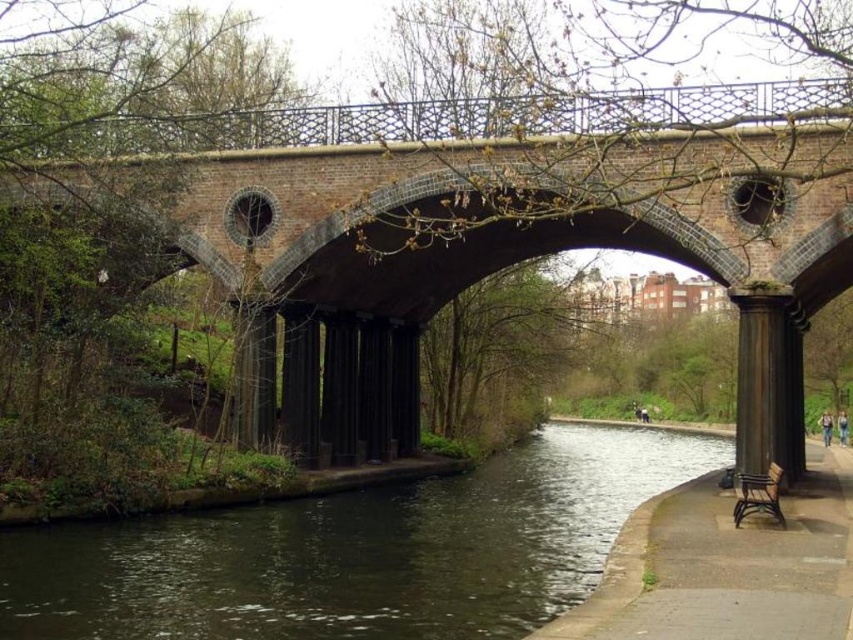
You are a tourist visiting the canal and want to take a photo of the black polished stone column at right and the rustic wood bench at lower right. Which object should you focus on first if you want to capture both in a single frame without moving the camera?

The black polished stone column at right is bigger than the rustic wood bench at lower right, so you should focus on the black polished stone column at right first to ensure it fits properly in the frame.

You are a maintenance worker needing to move a 2.5 meter long wooden plank from the black polished stone column at right to the rustic wood bench at lower right. Can you carry it horizontally without it touching the ground?

The distance between the black polished stone column at right and the rustic wood bench at lower right is 7.90 meters. Since the plank is only 2.5 meters long, it can be carried horizontally between them without touching the ground as the plank length is shorter than the distance between the two objects.

You are a tourist standing at the center of the bridge looking down at the canal. You notice the black polished stone column at right and the rustic wood bench at lower right. Which object is positioned to the right side from your viewpoint?

The black polished stone column at right is to the right of the rustic wood bench at lower right, so the black polished stone column at right is positioned to the right side from your viewpoint.